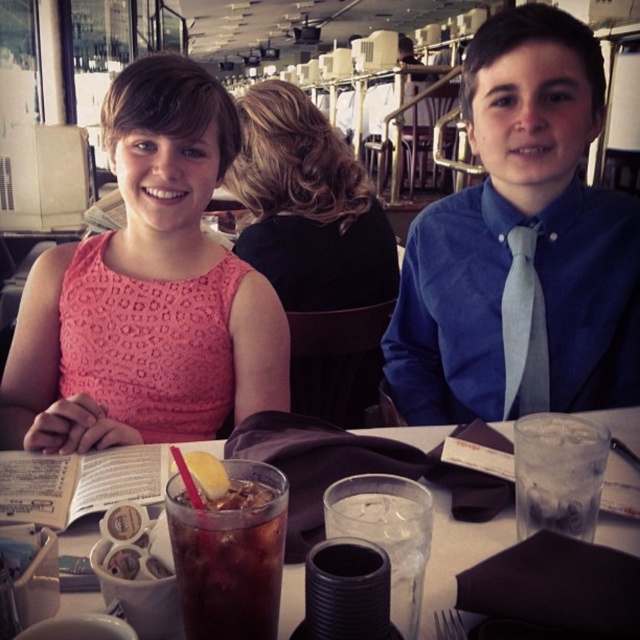
How far apart are clear plastic cup at table center and light gray silk tie at right?

clear plastic cup at table center is 66.26 centimeters from light gray silk tie at right.

Does clear plastic cup at table center have a smaller size compared to light gray silk tie at right?

Correct, clear plastic cup at table center occupies less space than light gray silk tie at right.

Where is `clear plastic cup at table center`? clear plastic cup at table center is located at coordinates (387, 532).

Is clear glass ice at table right bigger than light gray silk tie at right?

Actually, clear glass ice at table right might be smaller than light gray silk tie at right.

Is clear glass ice at table right positioned at the back of light gray silk tie at right?

No, clear glass ice at table right is in front of light gray silk tie at right.

Does point (588, 534) lie in front of point (502, 416)?

Yes, point (588, 534) is in front of point (502, 416).

Find the location of a particular element. This screenshot has height=640, width=640. clear glass ice at table right is located at coordinates (557, 474).

Can you confirm if clear glass ice at table right is thinner than clear plastic cup at table center?

No, clear glass ice at table right is not thinner than clear plastic cup at table center.

The height and width of the screenshot is (640, 640). I want to click on clear glass ice at table right, so click(557, 474).

Find the location of `clear glass ice at table right`. clear glass ice at table right is located at coordinates (557, 474).